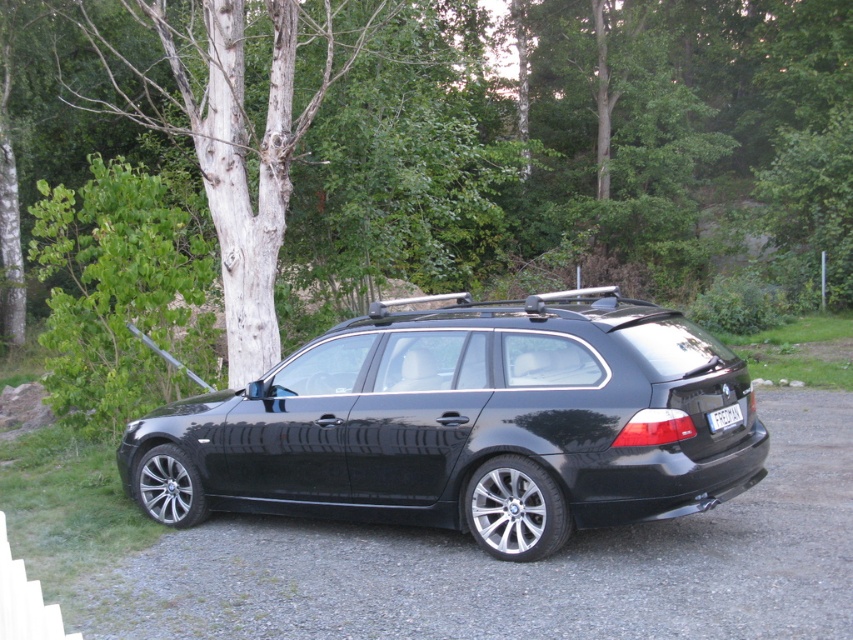
Can you confirm if glossy black car at center is smaller than smooth bark tree at left?

Indeed, glossy black car at center has a smaller size compared to smooth bark tree at left.

Between glossy black car at center and smooth bark tree at left, which one appears on the left side from the viewer's perspective?

From the viewer's perspective, smooth bark tree at left appears more on the left side.

Does point (660, 317) come closer to viewer compared to point (248, 65)?

That is True.

The image size is (853, 640). I want to click on glossy black car at center, so click(466, 426).

Between glossy black car at center and white plastic license plate at rear, which one is positioned higher?

white plastic license plate at rear is higher up.

Between glossy black car at center and white plastic license plate at rear, which one is positioned lower?

Positioned lower is glossy black car at center.

Based on the photo, measure the distance between glossy black car at center and camera.

glossy black car at center and camera are 6.70 meters apart from each other.

This screenshot has height=640, width=853. Find the location of `glossy black car at center`. glossy black car at center is located at coordinates (466, 426).

Describe the element at coordinates (466, 426) in the screenshot. The width and height of the screenshot is (853, 640). I see `glossy black car at center` at that location.

How much distance is there between glossy black car at center and black asphalt at center?

glossy black car at center is 5.66 feet from black asphalt at center.

Find the location of `glossy black car at center`. glossy black car at center is located at coordinates (466, 426).